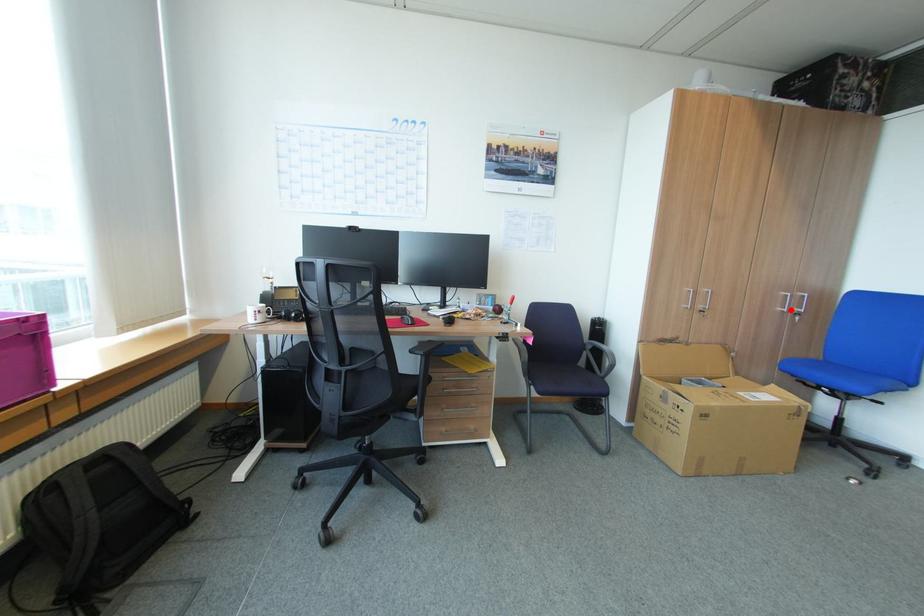
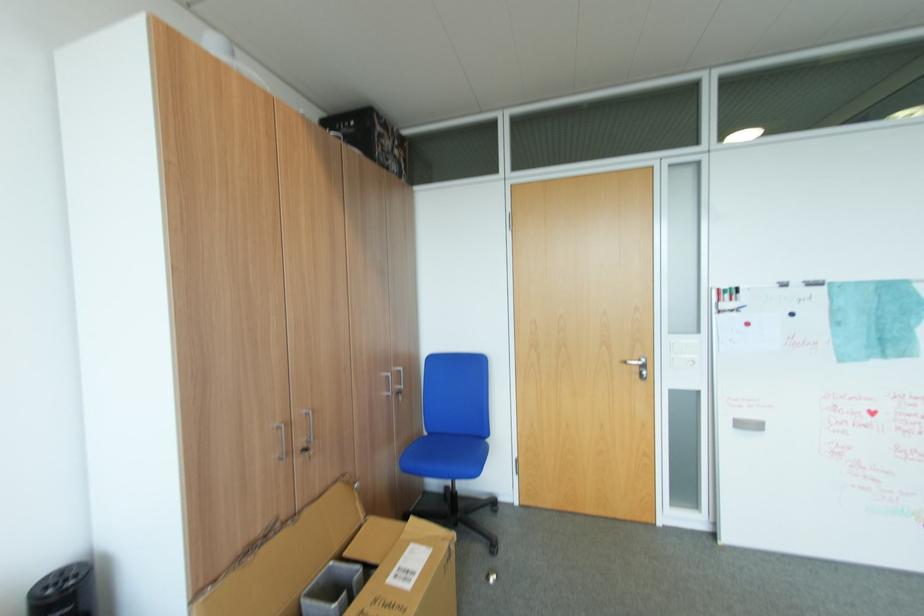
Question: I am providing you with two images of the same scene from different viewpoints. Given a red point in image1, look at the same physical point in image2. Is it:

Choices:
 (A) Closer to the viewpoint
 (B) Farther from the viewpoint

Answer: (B)